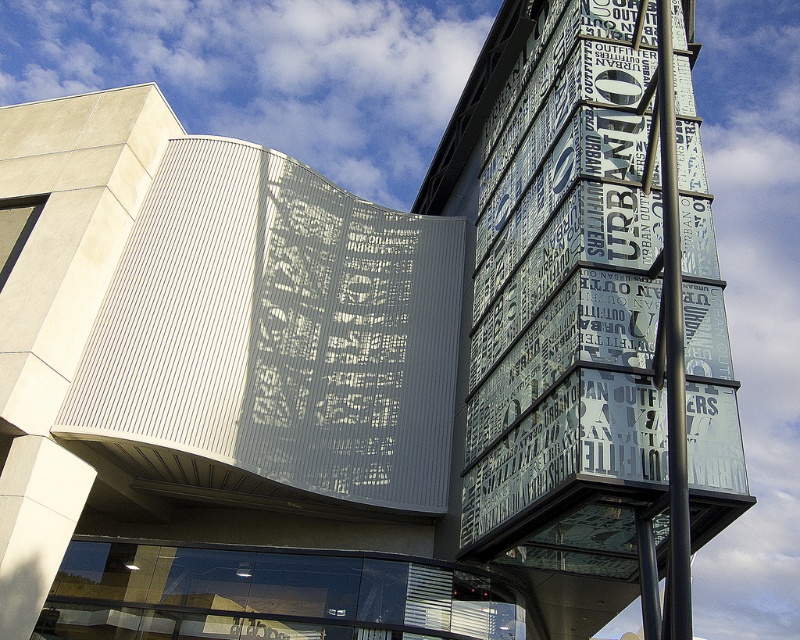
Question: In this image, where is transparent glass sign at upper right located relative to metallic pole at center?

Choices:
 (A) above
 (B) below

Answer: (A)

Question: Can you confirm if transparent glass sign at upper right is smaller than metallic pole at center?

Choices:
 (A) yes
 (B) no

Answer: (B)

Question: Which object appears farthest from the camera in this image?

Choices:
 (A) metallic pole at center
 (B) transparent glass sign at upper right

Answer: (B)

Question: Is transparent glass sign at upper right thinner than metallic pole at center?

Choices:
 (A) yes
 (B) no

Answer: (B)

Question: Which object is closer to the camera taking this photo?

Choices:
 (A) transparent glass sign at upper right
 (B) metallic pole at center

Answer: (B)